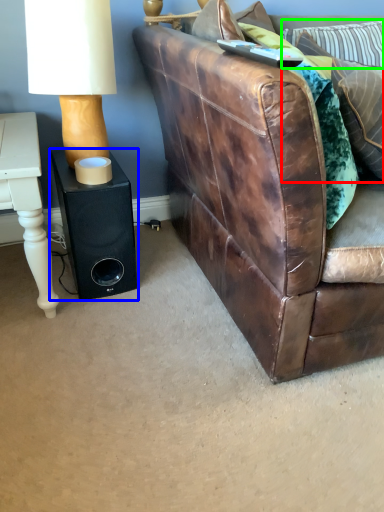
Question: Considering the real-world distances, which object is farthest from pillow (highlighted by a red box)? speaker (highlighted by a blue box) or pillow (highlighted by a green box)?

Choices:
 (A) speaker
 (B) pillow

Answer: (A)